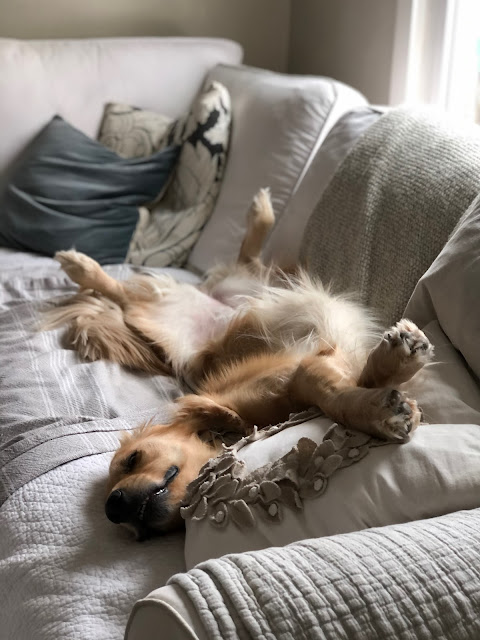
You are a GUI agent. You are given a task and a screenshot of the screen. Output one action in this format:
    pyautogui.click(x=<x>, y=<y>)
    Task: Click on the pillow
    This screenshot has width=480, height=640.
    Given the screenshot: What is the action you would take?
    pyautogui.click(x=432, y=482)